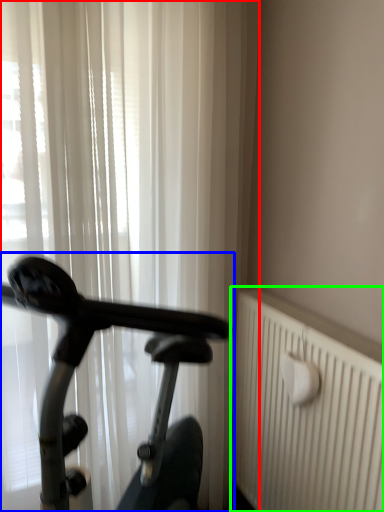
Question: Which is farther away from curtain (highlighted by a red box)? bicycle (highlighted by a blue box) or radiator (highlighted by a green box)?

Choices:
 (A) bicycle
 (B) radiator

Answer: (B)